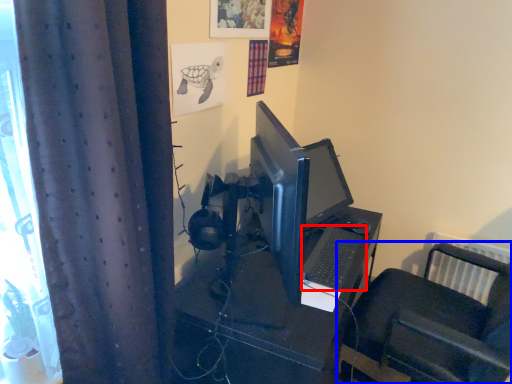
Question: Which point is further to the camera, computer keyboard (highlighted by a red box) or furniture (highlighted by a blue box)?

Choices:
 (A) computer keyboard
 (B) furniture

Answer: (B)